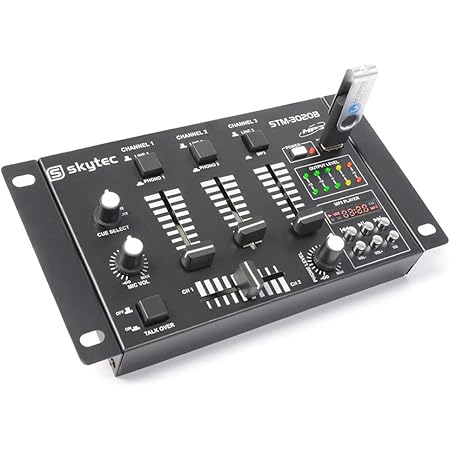
Locate an element on the screen. green led light is located at coordinates (328, 171).